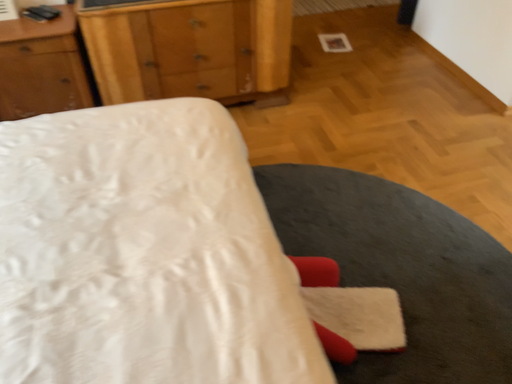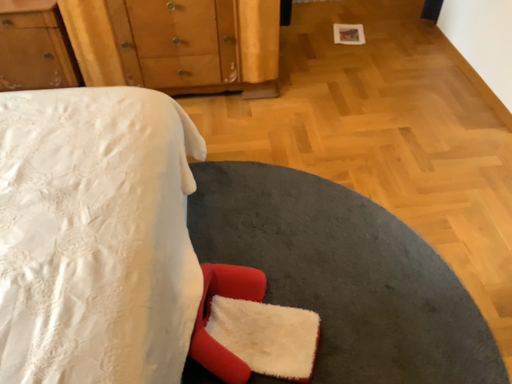
Question: Which way did the camera rotate in the video?

Choices:
 (A) rotated right
 (B) rotated left

Answer: (B)